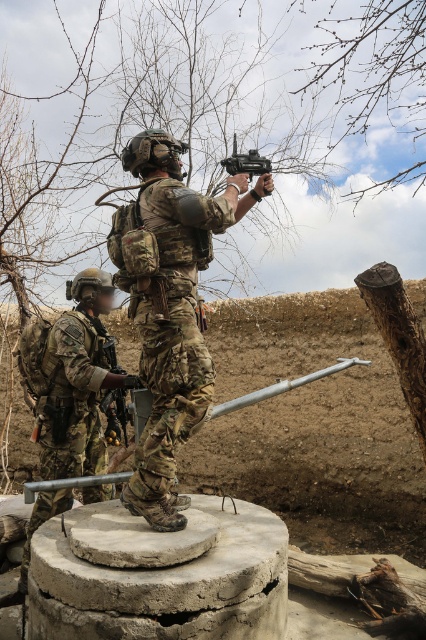
Who is lower down, camouflage uniform at center or camouflage uniform at left?

camouflage uniform at left is lower down.

Is camouflage uniform at center closer to the viewer compared to camouflage uniform at left?

That is True.

You are a GUI agent. You are given a task and a screenshot of the screen. Output one action in this format:
    pyautogui.click(x=<x>, y=<y>)
    Task: Click on the camouflage uniform at center
    The image size is (426, 640).
    Given the screenshot: What is the action you would take?
    pyautogui.click(x=169, y=307)

Does point (72, 344) come in front of point (238, 161)?

No.

The image size is (426, 640). What are the coordinates of `camouflage uniform at left` in the screenshot? It's located at (71, 378).

The image size is (426, 640). I want to click on camouflage uniform at left, so click(x=71, y=378).

Is point (155, 337) positioned behind point (233, 138)?

No.

Which is above, camouflage uniform at center or matte black toy gun at center?

matte black toy gun at center is above.

Describe the element at coordinates (169, 307) in the screenshot. This screenshot has width=426, height=640. I see `camouflage uniform at center` at that location.

The width and height of the screenshot is (426, 640). In order to click on camouflage uniform at center in this screenshot , I will do `click(169, 307)`.